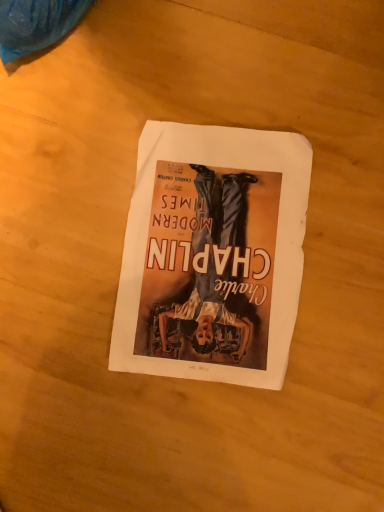
Question: Should I look upward or downward to see white paper at center?

Choices:
 (A) up
 (B) down

Answer: (A)